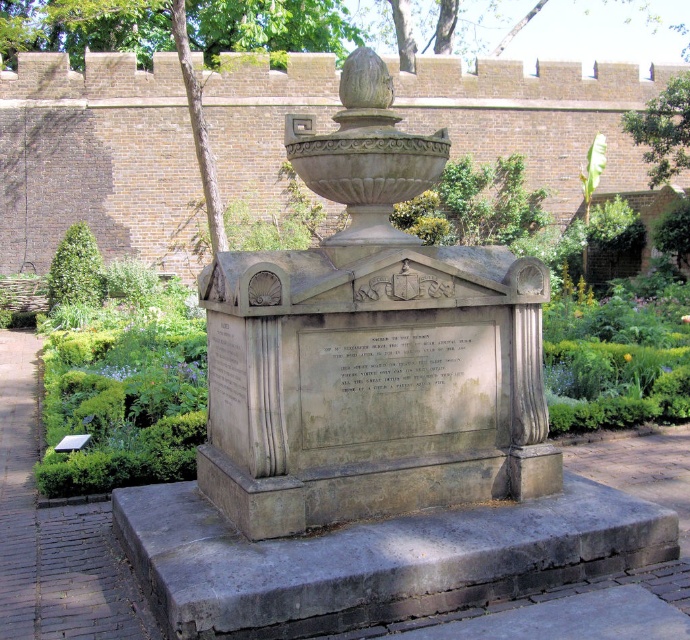
Question: Among these points, which one is farthest from the camera?

Choices:
 (A) (511, 339)
 (B) (669, 90)

Answer: (B)

Question: Which point is farther to the camera?

Choices:
 (A) green leafy tree at upper right
 (B) gray stone monument at center

Answer: (A)

Question: Is gray stone monument at center to the right of green leafy tree at upper right from the viewer's perspective?

Choices:
 (A) yes
 (B) no

Answer: (B)

Question: Where is gray stone monument at center located in relation to green leafy tree at upper right in the image?

Choices:
 (A) right
 (B) left

Answer: (B)

Question: Does gray stone monument at center appear over green leafy tree at upper right?

Choices:
 (A) no
 (B) yes

Answer: (A)

Question: Which object appears closest to the camera in this image?

Choices:
 (A) green leafy tree at upper right
 (B) gray stone monument at center

Answer: (B)